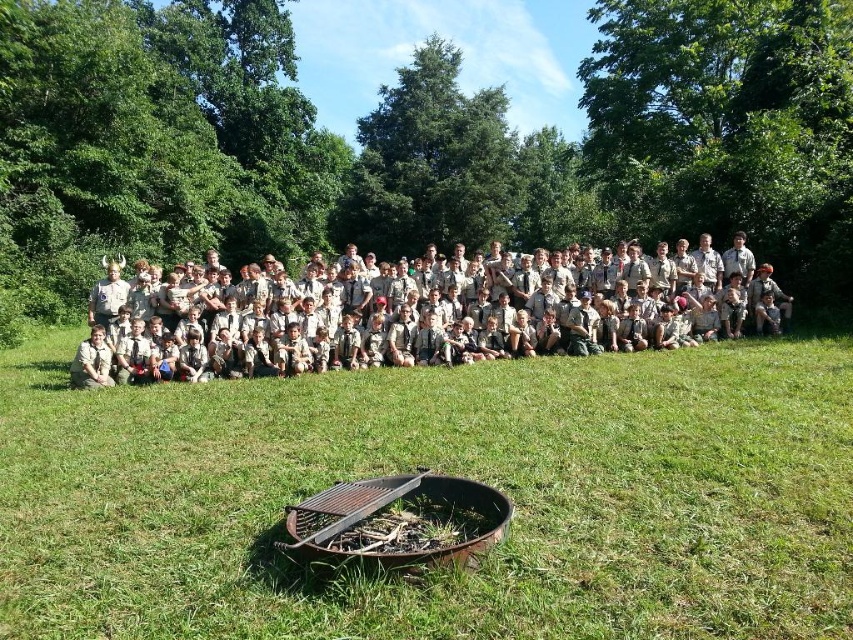
Question: Where is green grass at center located in relation to black metal fire pit at lower center in the image?

Choices:
 (A) above
 (B) below

Answer: (A)

Question: Can you confirm if green grass at center is smaller than black metal fire pit at lower center?

Choices:
 (A) yes
 (B) no

Answer: (B)

Question: Where is tan uniform at center located in relation to black metal fire pit at lower center in the image?

Choices:
 (A) above
 (B) below

Answer: (A)

Question: Which object appears closest to the camera in this image?

Choices:
 (A) green grass at center
 (B) tan uniform at center
 (C) black metal fire pit at lower center

Answer: (A)

Question: Based on their relative distances, which object is farther from the tan uniform at center?

Choices:
 (A) green grass at center
 (B) black metal fire pit at lower center

Answer: (B)

Question: Which object is the closest to the black metal fire pit at lower center?

Choices:
 (A) green grass at center
 (B) tan uniform at center

Answer: (A)